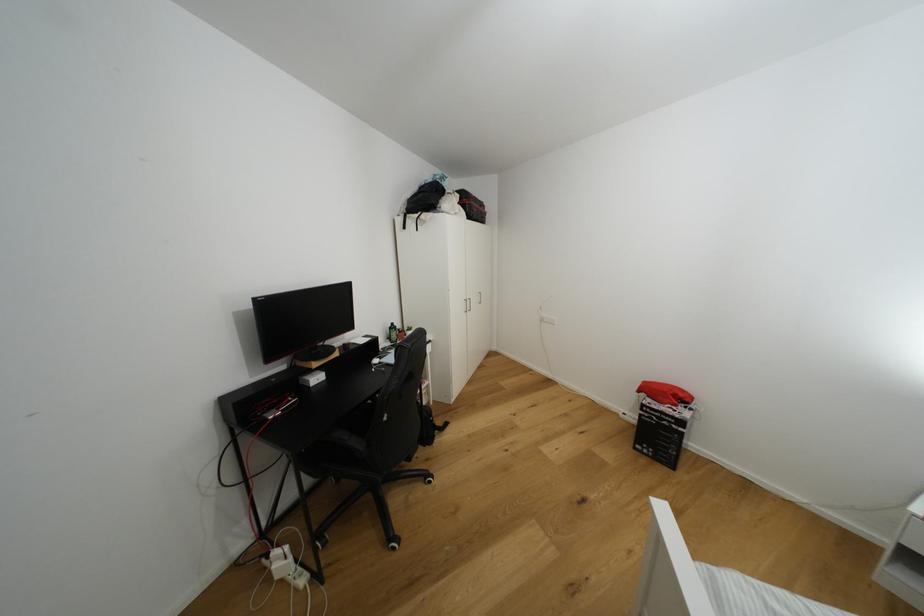
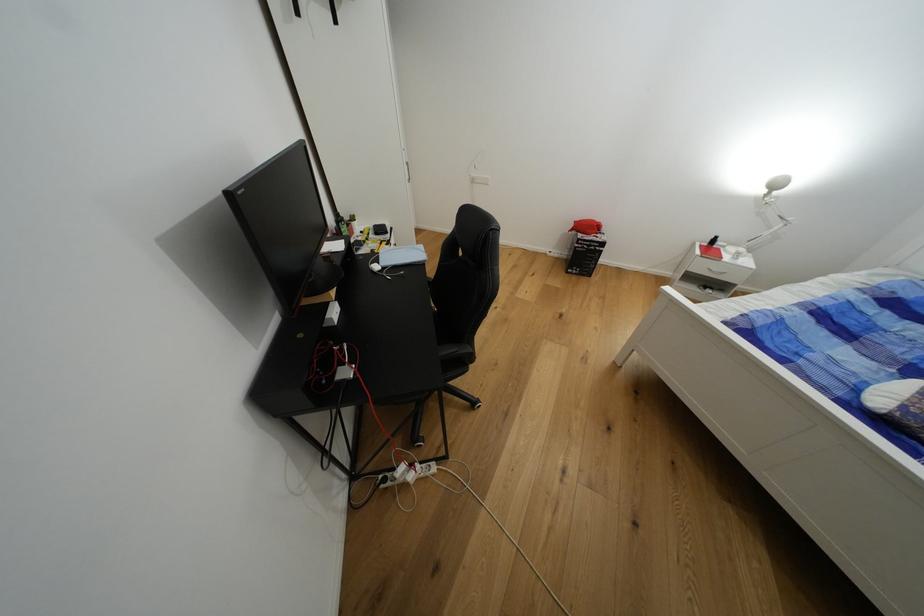
Find the pixel in the second image that matches point (385, 359) in the first image.

(383, 262)